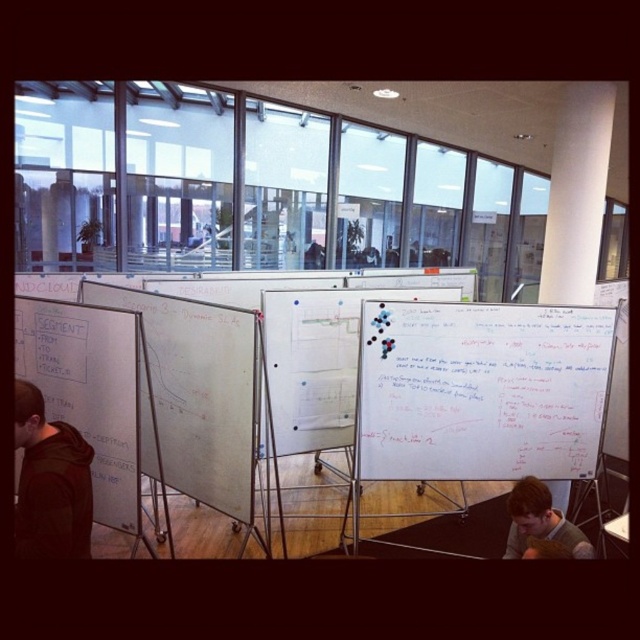
Is white matte whiteboard at left shorter than white smooth pillar at upper center?

Indeed, white matte whiteboard at left has a lesser height compared to white smooth pillar at upper center.

Is the position of white matte whiteboard at left less distant than that of white smooth pillar at upper center?

Yes, white matte whiteboard at left is closer to the viewer.

What do you see at coordinates (90, 392) in the screenshot? The width and height of the screenshot is (640, 640). I see `white matte whiteboard at left` at bounding box center [90, 392].

You are a GUI agent. You are given a task and a screenshot of the screen. Output one action in this format:
    pyautogui.click(x=<x>, y=<y>)
    Task: Click on the white matte whiteboard at left
    
    Given the screenshot: What is the action you would take?
    pyautogui.click(x=90, y=392)

Which is behind, point (556, 346) or point (609, 106)?

The point (609, 106) is behind.

Is the position of whiteboard at center more distant than that of white smooth pillar at upper center?

No.

Find the location of `whiteboard at center`. whiteboard at center is located at coordinates (481, 390).

Is white smooth pillar at upper center below gray sweater at lower right?

No.

Does white smooth pillar at upper center appear on the right side of gray sweater at lower right?

Indeed, white smooth pillar at upper center is positioned on the right side of gray sweater at lower right.

What do you see at coordinates (577, 193) in the screenshot? This screenshot has height=640, width=640. I see `white smooth pillar at upper center` at bounding box center [577, 193].

You are a GUI agent. You are given a task and a screenshot of the screen. Output one action in this format:
    pyautogui.click(x=<x>, y=<y>)
    Task: Click on the white smooth pillar at upper center
    This screenshot has width=640, height=640.
    Given the screenshot: What is the action you would take?
    pyautogui.click(x=577, y=193)